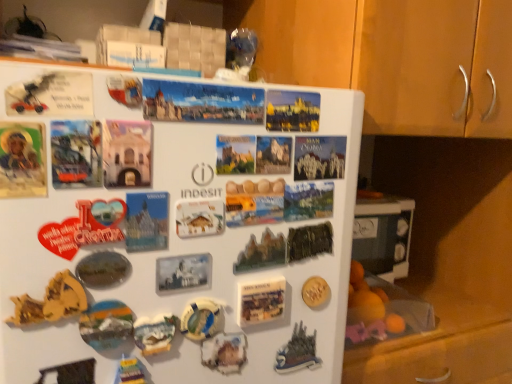
Question: Considering the positions of matte plastic postcard at center, the first postcard positioned from the bottom, and metallic silver castle at lower right, the eighth art in the left-to-right sequence, in the image, is matte plastic postcard at center, the first postcard positioned from the bottom, wider or thinner than metallic silver castle at lower right, the eighth art in the left-to-right sequence,?

Choices:
 (A) thin
 (B) wide

Answer: (A)

Question: Relative to metallic silver castle at lower right, which appears as the 3th art when viewed from the right, is matte plastic postcard at center, which ranks as the fourth postcard in top-to-bottom order, in front or behind?

Choices:
 (A) front
 (B) behind

Answer: (A)

Question: Which object is positioned closest to the gold textured coin at center, which is counted as the first art, starting from the right?

Choices:
 (A) wooden cabinet at upper right
 (B) metallic gold leaf at upper right, which appears as the second art when viewed from the right
 (C) matte paper postcard at upper right, placed as the third postcard when sorted from bottom to top
 (D) green matte magnet at center, arranged as the 7th art when viewed from the left
 (E) metallic silver magnet at lower left, which is the 3th art from left to right

Answer: (B)

Question: Based on their relative distances, which object is farther from the matte paper postcard at upper right, placed as the third postcard when sorted from bottom to top?

Choices:
 (A) matte paper postcard at center, the 3th postcard when ordered from top to bottom
 (B) metallic gold leaf at upper right, which appears as the second art when viewed from the right
 (C) matte plastic magnet at center, which is counted as the 5th art, starting from the right
 (D) metallic mirror at center, positioned as the 9th art in right-to-left order
 (E) matte plastic postcard at center, the first postcard positioned from the bottom

Answer: (D)